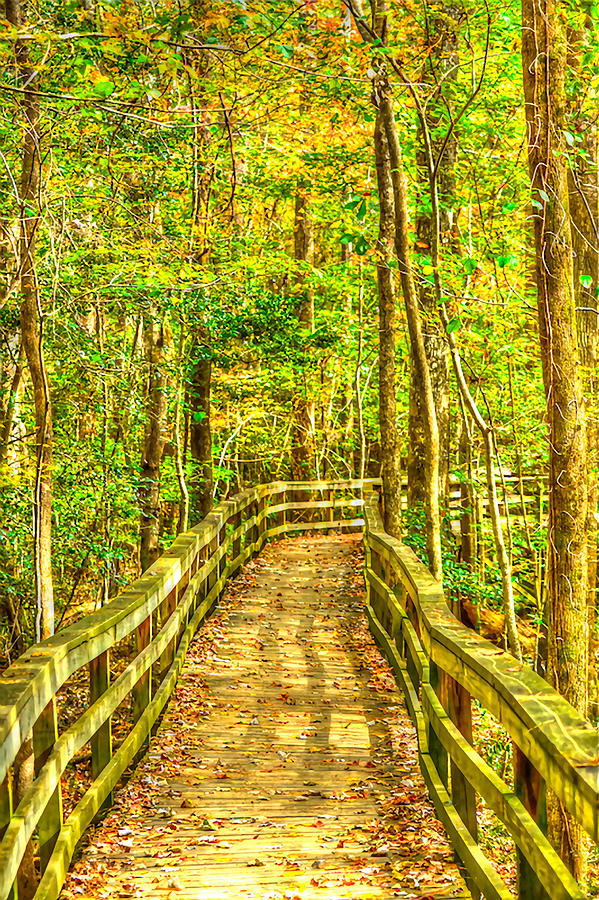
Identify the location of wooden rails. The width and height of the screenshot is (599, 900). (515, 680), (96, 627).